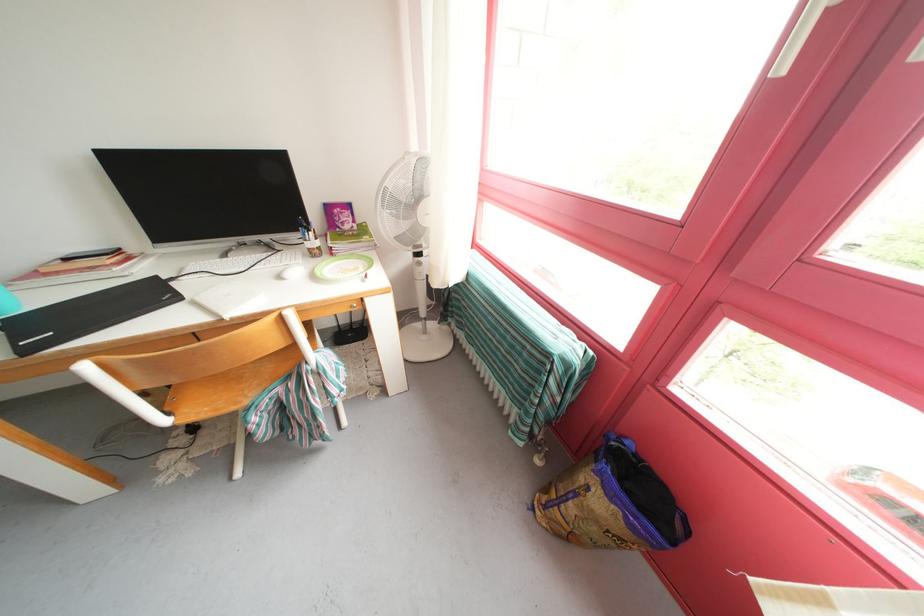
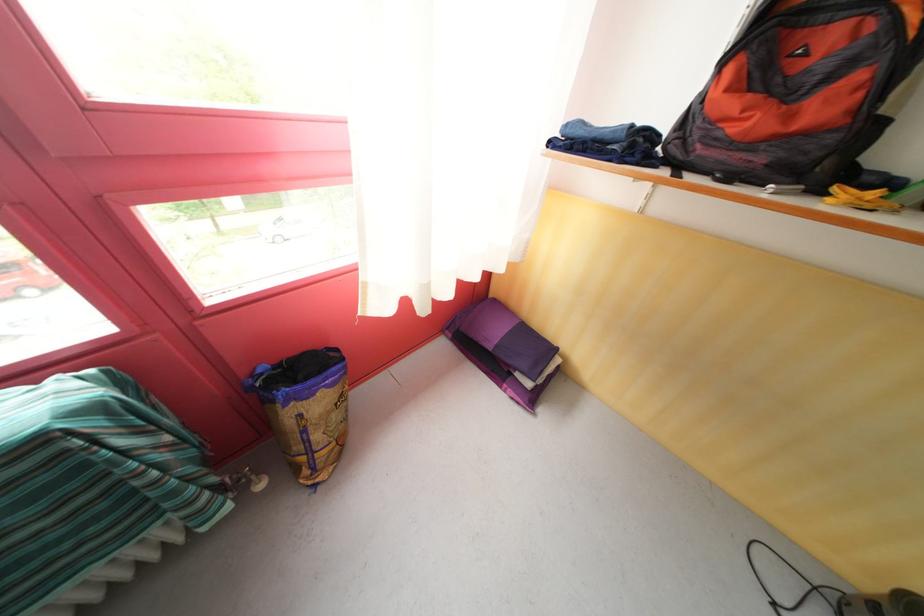
How did the camera likely rotate?

The camera rotated toward right-down.